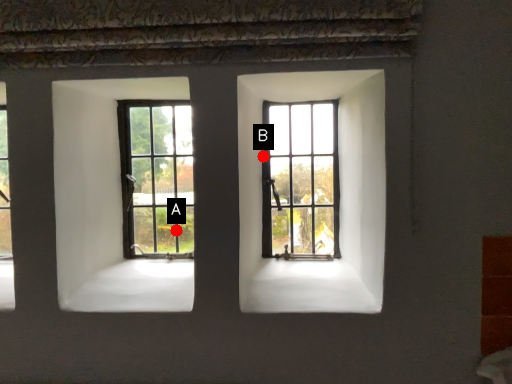
Question: Two points are circled on the image, labeled by A and B beside each circle. Among these points, which one is farthest from the camera?

Choices:
 (A) A is further
 (B) B is further

Answer: (A)